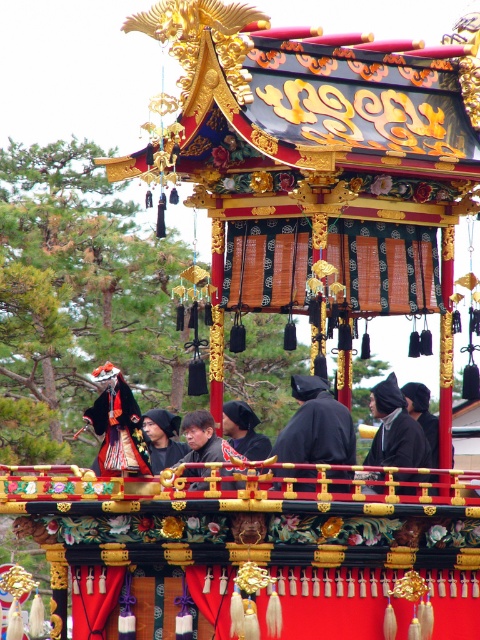
Is black matte robe at center positioned at the back of black matte clothing at center?

That is False.

Is point (295, 451) positioned before point (424, 436)?

That is True.

Locate an element on the screen. black matte robe at center is located at coordinates (317, 433).

Is black matte robe at center closer to camera compared to matte black mask at center?

Yes, it is.

In the scene shown: Is black matte robe at center to the right of matte black mask at center from the viewer's perspective?

Yes, black matte robe at center is to the right of matte black mask at center.

Is point (327, 451) less distant than point (163, 417)?

Yes, it is.

Find the location of a particular element. The height and width of the screenshot is (640, 480). black matte robe at center is located at coordinates (317, 433).

Does black matte clothing at center come in front of matte black mask at center?

No, it is behind matte black mask at center.

Between black matte clothing at center and matte black mask at center, which one is positioned lower?

matte black mask at center is lower down.

Image resolution: width=480 pixels, height=640 pixels. Describe the element at coordinates (396, 429) in the screenshot. I see `black matte clothing at center` at that location.

Image resolution: width=480 pixels, height=640 pixels. Identify the location of black matte clothing at center. (396, 429).